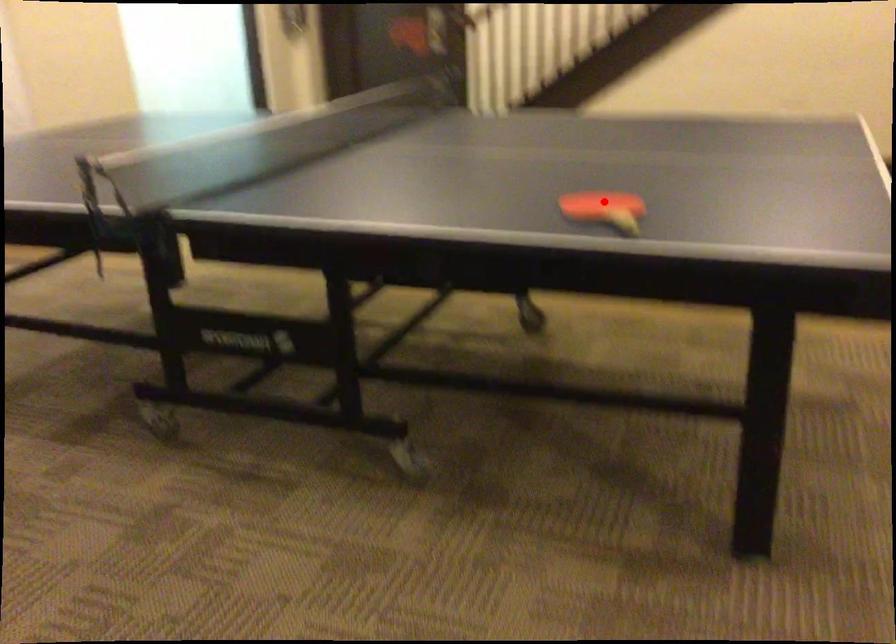
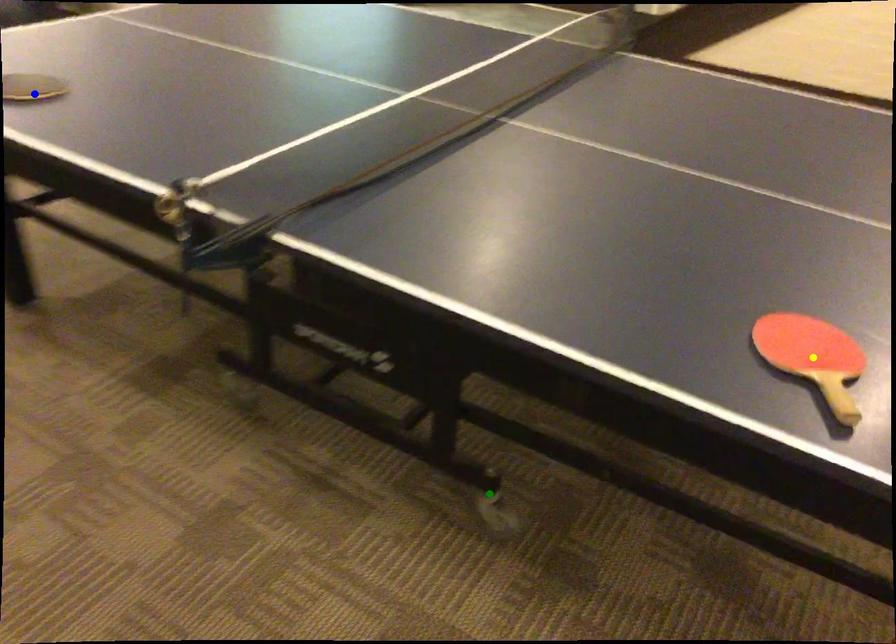
Question: I am providing you with two images of the same scene from different viewpoints. A red point is marked on the first image. You are given multiple points on the second image. Can you choose the point in image 2 that corresponds to the point in image 1?

Choices:
 (A) yellow point
 (B) green point
 (C) blue point

Answer: (A)